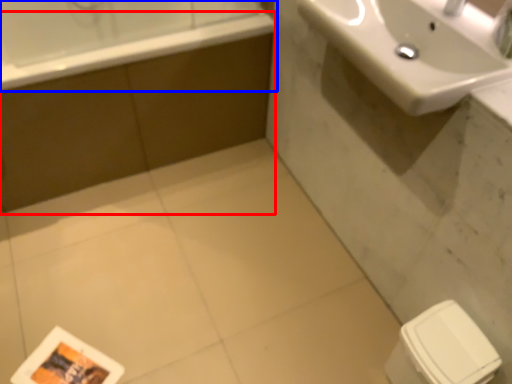
Question: Among these objects, which one is farthest to the camera, bath (highlighted by a red box) or bathtub (highlighted by a blue box)?

Choices:
 (A) bath
 (B) bathtub

Answer: (A)